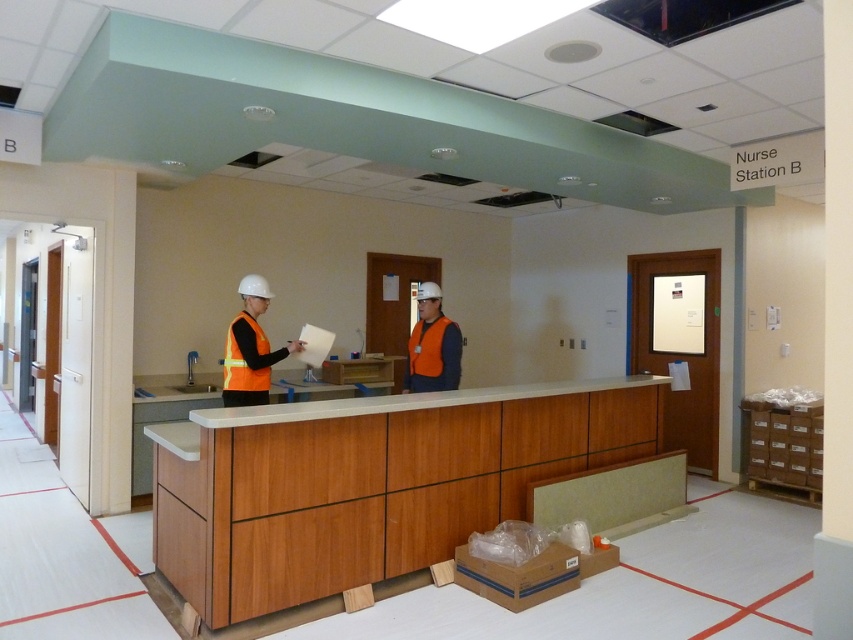
Question: From the image, what is the correct spatial relationship of wooden cabinet at center in relation to matte orange safety vest at center?

Choices:
 (A) above
 (B) below

Answer: (B)

Question: Does matte orange safety vest at center have a greater width compared to orange reflective safety vest at center?

Choices:
 (A) no
 (B) yes

Answer: (B)

Question: Which point appears closest to the camera in this image?

Choices:
 (A) (428, 330)
 (B) (413, 336)
 (C) (451, 412)

Answer: (C)

Question: Which of the following is the farthest from the observer?

Choices:
 (A) orange reflective vest at center
 (B) wooden cabinet at center
 (C) high-visibility orange safety vest at center

Answer: (C)

Question: Which object is farther from the camera taking this photo?

Choices:
 (A) matte orange safety vest at center
 (B) high-visibility orange safety vest at center
 (C) orange reflective vest at center

Answer: (A)

Question: Can you confirm if matte orange safety vest at center is positioned below high-visibility orange safety vest at center?

Choices:
 (A) yes
 (B) no

Answer: (A)